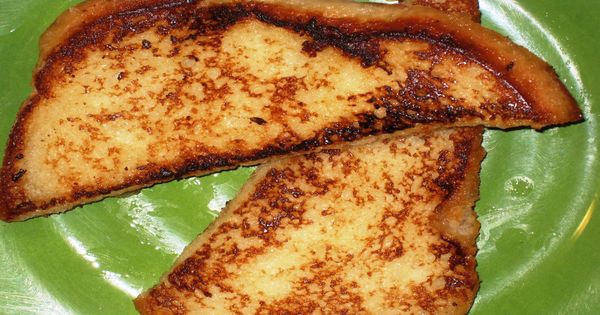
Locate an element on the screen. light reflecting on dinner plate is located at coordinates (493, 14), (220, 198), (171, 234), (122, 282).